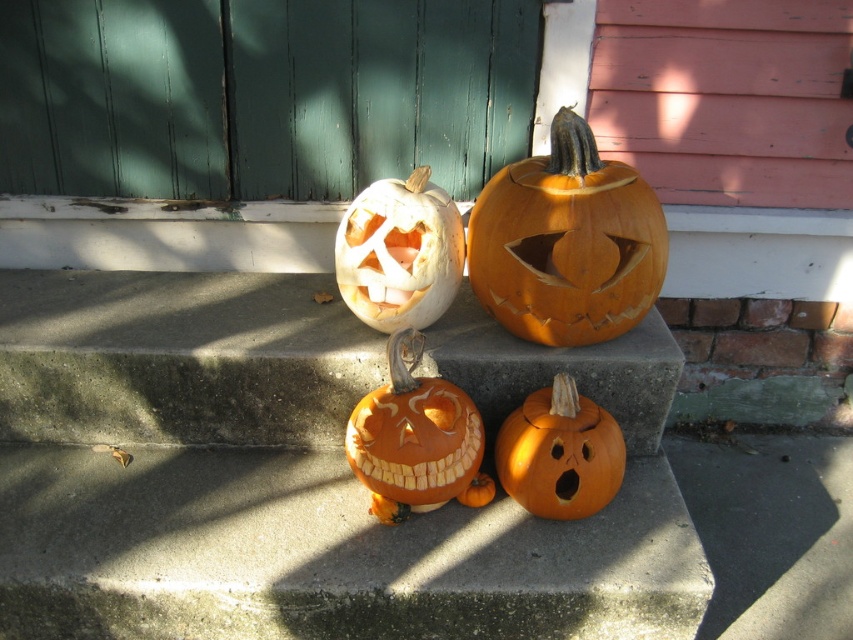
Question: Considering the real-world distances, which object is farthest from the smooth orange pumpkin at center?

Choices:
 (A) orange matte pumpkin at center
 (B) orange matte carved pumpkin at center

Answer: (B)

Question: Is orange matte carved pumpkin at center smaller than orange matte pumpkin at center?

Choices:
 (A) no
 (B) yes

Answer: (A)

Question: Which point is closer to the camera taking this photo?

Choices:
 (A) (466, 413)
 (B) (587, 406)

Answer: (A)

Question: Does smooth orange pumpkin at center appear over orange matte pumpkin at center?

Choices:
 (A) no
 (B) yes

Answer: (B)

Question: From the image, what is the correct spatial relationship of smooth orange pumpkin at center in relation to orange matte pumpkin at center?

Choices:
 (A) right
 (B) left

Answer: (A)

Question: Among these points, which one is farthest from the camera?

Choices:
 (A) (419, 269)
 (B) (390, 372)
 (C) (543, 192)

Answer: (A)